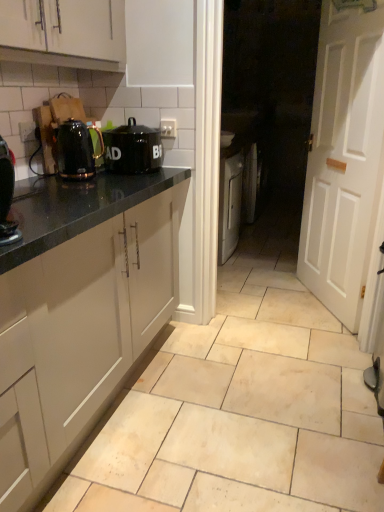
What is the approximate width of black matte canister at upper center?

The width of black matte canister at upper center is 11.98 inches.

The height and width of the screenshot is (512, 384). In order to click on beige ceramic tile at center in this screenshot , I will do `click(240, 414)`.

This screenshot has height=512, width=384. I want to click on black glossy coffee machine at left, so click(7, 196).

From the picture: Which object is wider, shiny black kettle at left or black glossy coffee machine at left?

With larger width is shiny black kettle at left.

From a real-world perspective, is shiny black kettle at left on top of black glossy coffee machine at left?

No, from a real-world perspective, shiny black kettle at left is not over black glossy coffee machine at left

Is shiny black kettle at left touching black glossy coffee machine at left?

No, shiny black kettle at left is not making contact with black glossy coffee machine at left.

From a real-world perspective, is shiny black kettle at left physically above white wooden door at right?

Yes, from a real-world perspective, shiny black kettle at left is on top of white wooden door at right.

Is the surface of shiny black kettle at left in direct contact with white wooden door at right?

shiny black kettle at left and white wooden door at right are clearly separated.

How much distance is there between shiny black kettle at left and white wooden door at right?

They are 1.46 meters apart.

Find the location of a particular element. The height and width of the screenshot is (512, 384). door on the right of shiny black kettle at left is located at coordinates (344, 157).

Which of these two, white wooden door at right or shiny black kettle at left, is bigger?

white wooden door at right is bigger.

Which object is thinner, white wooden door at right or shiny black kettle at left?

Thinner between the two is white wooden door at right.

Can you confirm if white wooden door at right is taller than shiny black kettle at left?

Yes, white wooden door at right is taller than shiny black kettle at left.

Visually, is white wooden door at right positioned to the left or to the right of shiny black kettle at left?

white wooden door at right is positioned on shiny black kettle at left's right side.

Is beige ceramic tile at center with black glossy coffee machine at left?

No, beige ceramic tile at center is not in contact with black glossy coffee machine at left.

Is beige ceramic tile at center in front of black glossy coffee machine at left?

No, it is behind black glossy coffee machine at left.

Who is shorter, beige ceramic tile at center or black glossy coffee machine at left?

With less height is beige ceramic tile at center.

From the picture: Is white matte cabinet at upper left not inside beige ceramic tile at center?

Yes, white matte cabinet at upper left is not within beige ceramic tile at center.

How many degrees apart are the facing directions of white matte cabinet at upper left and beige ceramic tile at center?

white matte cabinet at upper left and beige ceramic tile at center are facing 0.0712 degrees away from each other.

Considering the relative positions of white matte cabinet at upper left and beige ceramic tile at center in the image provided, is white matte cabinet at upper left behind beige ceramic tile at center?

Yes, white matte cabinet at upper left is further from the camera.

From a real-world perspective, is white matte cabinet at upper left on beige ceramic tile at center?

Yes.

How many degrees apart are the facing directions of beige ceramic tile at center and shiny black kettle at left?

The facing directions of beige ceramic tile at center and shiny black kettle at left are 5.09 degrees apart.

From the image's perspective, who appears lower, beige ceramic tile at center or shiny black kettle at left?

beige ceramic tile at center is shown below in the image.

Who is taller, beige ceramic tile at center or shiny black kettle at left?

shiny black kettle at left is taller.

From a real-world perspective, which is physically above, white wooden door at right or black glossy coffee machine at left?

From a 3D spatial view, black glossy coffee machine at left is above.

Considering the relative positions of white wooden door at right and black glossy coffee machine at left in the image provided, is white wooden door at right to the left or to the right of black glossy coffee machine at left?

Clearly, white wooden door at right is on the right of black glossy coffee machine at left in the image.

In the scene shown: Looking at the image, does white wooden door at right seem bigger or smaller compared to black glossy coffee machine at left?

In the image, white wooden door at right appears to be larger than black glossy coffee machine at left.

Between point (380, 123) and point (13, 170), which one is positioned behind?

The point (380, 123) is behind.

Locate an element on the screen. The height and width of the screenshot is (512, 384). kitchen appliance that appears below the black glossy coffee machine at left (from a real-world perspective) is located at coordinates (76, 150).

Find the location of a particular element. kitchen appliance below the white wooden door at right (from the image's perspective) is located at coordinates (76, 150).

Considering their positions, is black glossy coffee machine at left positioned closer to beige ceramic tile at center than white matte cabinet at upper left?

black glossy coffee machine at left is positioned closer to the anchor beige ceramic tile at center.

Which object lies further to the anchor point black glossy coffee machine at left, white wooden door at right or shiny black kettle at left?

white wooden door at right.

From the image, which object appears to be nearer to beige ceramic tile at center, white wooden door at right or black matte canister at upper center?

Among the two, white wooden door at right is located nearer to beige ceramic tile at center.

From the image, which object appears to be farther from white matte cabinet at upper left, beige ceramic tile at center or white wooden door at right?

Based on the image, beige ceramic tile at center appears to be further to white matte cabinet at upper left.

Considering their positions, is black matte canister at upper center positioned closer to beige ceramic tile at center than white wooden door at right?

white wooden door at right.

Based on their spatial positions, is white wooden door at right or black glossy coffee machine at left further from beige ceramic tile at center?

The object further to beige ceramic tile at center is black glossy coffee machine at left.

When comparing their distances from black matte canister at upper center, does beige ceramic tile at center or white matte cabinet at upper left seem further?

beige ceramic tile at center is positioned further to the anchor black matte canister at upper center.

Considering their positions, is black matte canister at upper center positioned further to white wooden door at right than white matte cabinet at upper left?

The object further to white wooden door at right is white matte cabinet at upper left.

Locate an element on the screen. kitchen appliance between white matte cabinet at upper left and black matte canister at upper center in the front-back direction is located at coordinates (76, 150).

Identify the location of coffee machine between shiny black kettle at left and beige ceramic tile at center in the up-down direction. pos(7,196).

You are a GUI agent. You are given a task and a screenshot of the screen. Output one action in this format:
    pyautogui.click(x=<x>, y=<y>)
    Task: Click on the home appliance that lies between white wooden door at right and beige ceramic tile at center from top to bottom
    This screenshot has height=512, width=384.
    Given the screenshot: What is the action you would take?
    pyautogui.click(x=132, y=149)

This screenshot has width=384, height=512. I want to click on home appliance between white matte cabinet at upper left and white wooden door at right, so click(x=132, y=149).